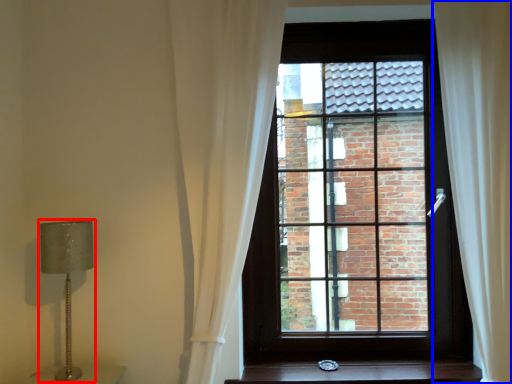
Question: Which object appears closest to the camera in this image, table lamp (highlighted by a red box) or curtain (highlighted by a blue box)?

Choices:
 (A) table lamp
 (B) curtain

Answer: (B)